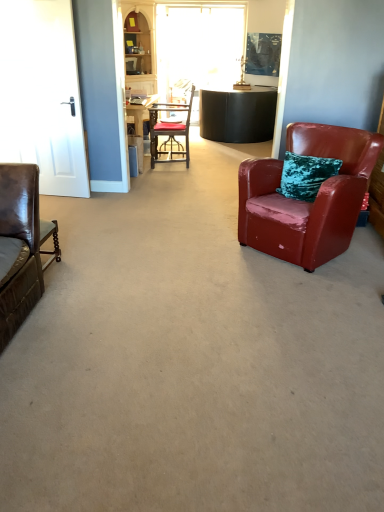
Question: Considering the positions of white glossy door at left and matte black chair at center, which is the second chair from bottom to top, in the image, is white glossy door at left wider or thinner than matte black chair at center, which is the second chair from bottom to top,?

Choices:
 (A) thin
 (B) wide

Answer: (A)

Question: From the image's perspective, is white glossy door at left positioned above or below matte black chair at center, the 1th chair viewed from the top?

Choices:
 (A) below
 (B) above

Answer: (A)

Question: Which of these objects is positioned farthest from the matte black chair at center, which is the first chair in left-to-right order?

Choices:
 (A) white glossy door at left
 (B) transparent glass window at center
 (C) wooden cabinet at upper left
 (D) shiny red leather armchair at right, which is the first chair in bottom-to-top order

Answer: (D)

Question: Which object is positioned farthest from the wooden cabinet at upper left?

Choices:
 (A) matte black chair at center, arranged as the 2th chair when viewed from the right
 (B) transparent glass window at center
 (C) shiny red leather armchair at right, arranged as the second chair when viewed from the back
 (D) white glossy door at left

Answer: (C)